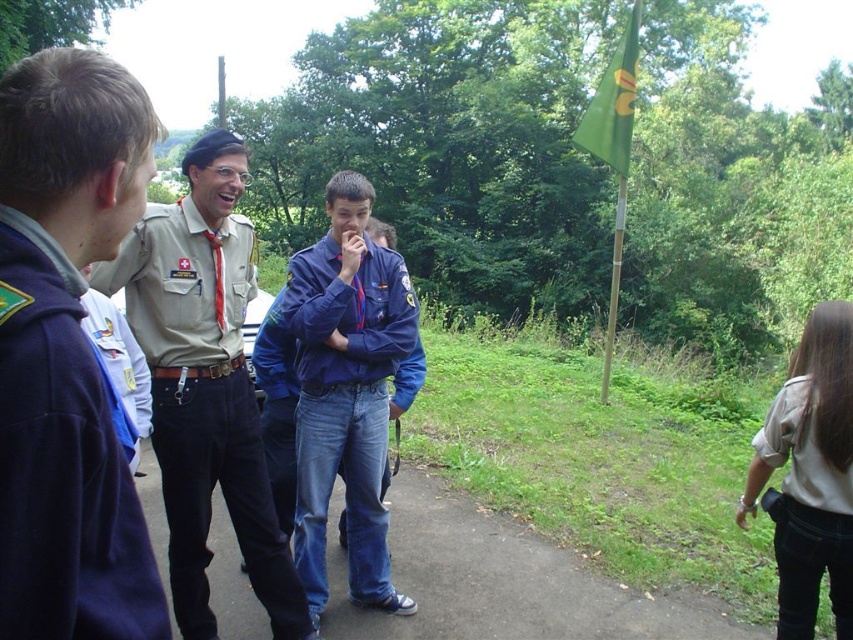
You are standing at the back of the group and want to locate the khaki uniform at center and the navy blue fleece at left. Which one do you see first when looking from the back?

The khaki uniform at center is above the navy blue fleece at left, so you will see the khaki uniform at center first when looking from the back.

You are standing in the middle of the gathering and want to take a photo that includes both the point at (x=776, y=461) and the point at (x=593, y=147). Since one of them is closer to you, which point should you focus on to ensure both are in clear focus?

You should focus on the point at (x=593, y=147) because it is farther from the camera, ensuring that the closer point at (x=776, y=461) will also be in focus due to depth of field.

You are a photographer trying to capture a group photo of the khaki uniform at center and the navy blue fleece at left. Based on their heights, which uniform should you place closer to the front to ensure both are visible?

The khaki uniform at center is shorter than the navy blue fleece at left, so you should place the khaki uniform at center in front to ensure both are visible.